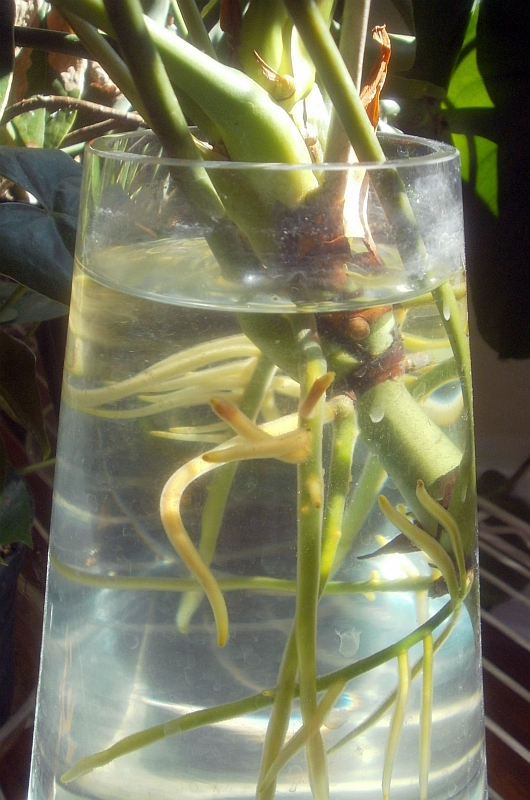
Find the location of `glass`. glass is located at coordinates [188, 260].